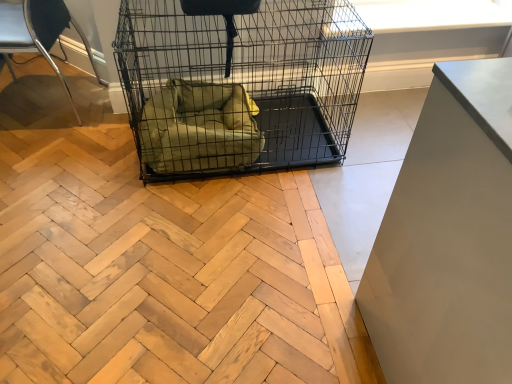
The height and width of the screenshot is (384, 512). In order to click on free location in front of green fabric dog bed at center in this screenshot , I will do `click(187, 220)`.